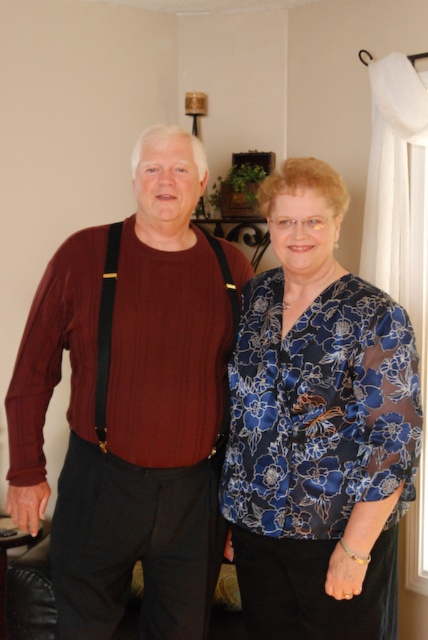
You are a GUI agent. You are given a task and a screenshot of the screen. Output one action in this format:
    pyautogui.click(x=<x>, y=<y>)
    Task: Click on the corduroy sweater at center
    This screenshot has height=640, width=428.
    Given the screenshot: What is the action you would take?
    pyautogui.click(x=131, y=404)

Is corduroy sweater at center to the right of blue satin blouse at center from the viewer's perspective?

No, corduroy sweater at center is not to the right of blue satin blouse at center.

Does point (59, 250) lie in front of point (368, 616)?

No.

Where is `corduroy sweater at center`? corduroy sweater at center is located at coordinates (131, 404).